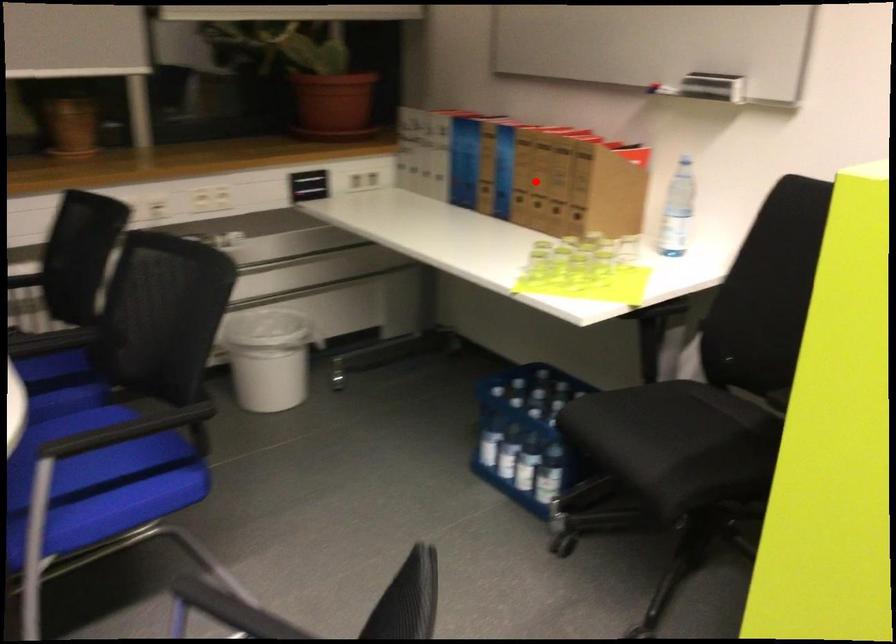
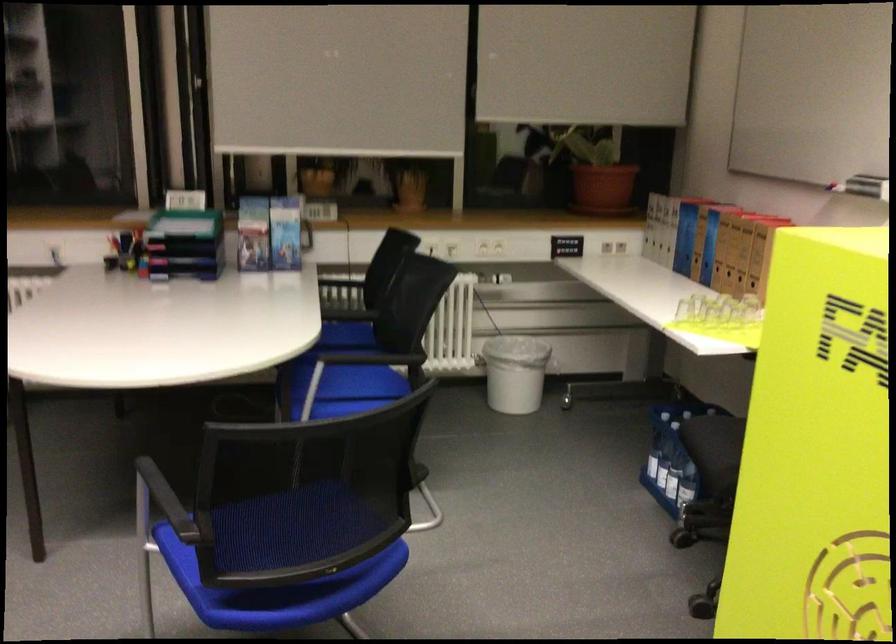
Find the pixel in the second image that matches the highlighted location in the first image.

(730, 251)